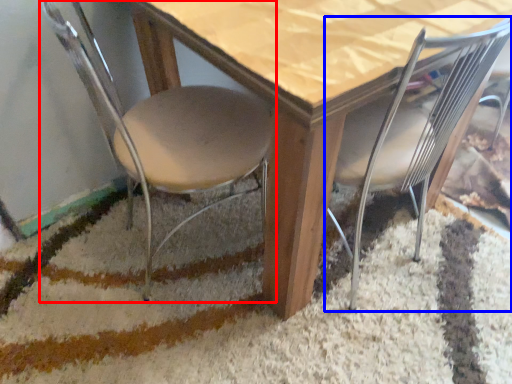
Question: Which object is closer to the camera taking this photo, chair (highlighted by a red box) or chair (highlighted by a blue box)?

Choices:
 (A) chair
 (B) chair

Answer: (A)